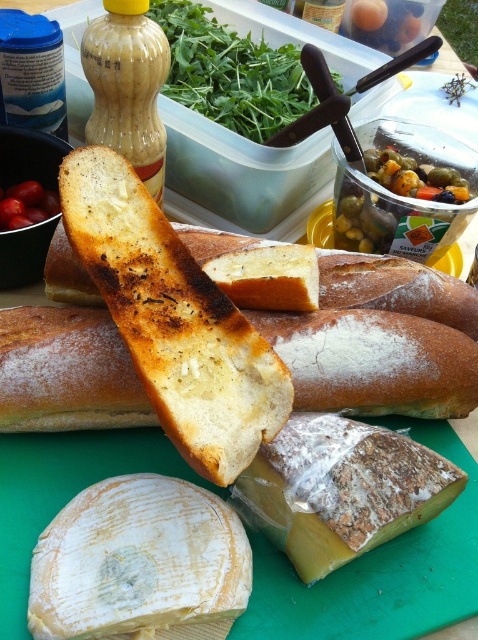
Question: Can you confirm if white crumbly cheese at center is smaller than green leafy vegetable at upper center?

Choices:
 (A) yes
 (B) no

Answer: (A)

Question: Which point is closer to the camera?

Choices:
 (A) white crumbly cheese at center
 (B) yellow wax cheese at center
 (C) brown crusty bread at center

Answer: (C)

Question: Which of the following is the closest to the observer?

Choices:
 (A) yellow wax cheese at center
 (B) white crumbly cheese at center
 (C) brown crusty bread at center
 (D) green leafy vegetable at upper center

Answer: (C)

Question: Is green leafy vegetable at upper center positioned in front of green olive at upper right?

Choices:
 (A) yes
 (B) no

Answer: (B)

Question: Can you confirm if yellow wax cheese at center is positioned below green leafy vegetable at upper center?

Choices:
 (A) yes
 (B) no

Answer: (A)

Question: Which point appears farthest from the camera in this image?

Choices:
 (A) (90, 264)
 (B) (271, 132)

Answer: (B)